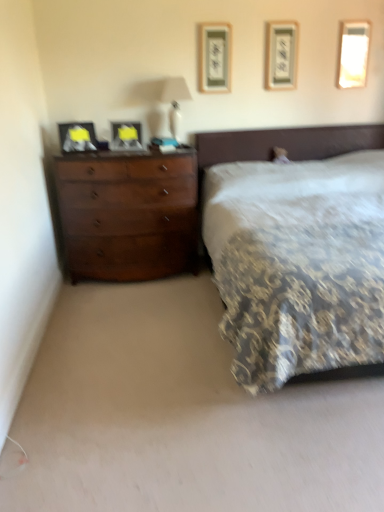
Identify the location of matte black picture frame at center, positioned as the fourth picture frame in right-to-left order. point(126,136).

Find the location of a particular element. Image resolution: width=384 pixels, height=512 pixels. matte wood picture frame at upper center, acting as the 3th picture frame starting from the right is located at coordinates (215, 57).

Describe the element at coordinates (281, 55) in the screenshot. I see `metallic silver picture frame at upper center, which is the fourth picture frame from left to right` at that location.

Where is `metallic silver picture frame at upper center, the 2th picture frame when ordered from right to left`? The height and width of the screenshot is (512, 384). metallic silver picture frame at upper center, the 2th picture frame when ordered from right to left is located at coordinates (281, 55).

Image resolution: width=384 pixels, height=512 pixels. Find the location of `patterned fabric bed at center`. patterned fabric bed at center is located at coordinates (280, 145).

The width and height of the screenshot is (384, 512). What do you see at coordinates (128, 215) in the screenshot?
I see `dark wood dresser at left` at bounding box center [128, 215].

Measure the distance between point (x=175, y=99) and camera.

11.29 feet.

Image resolution: width=384 pixels, height=512 pixels. Describe the element at coordinates (77, 137) in the screenshot. I see `matte black picture frame at left, placed as the 5th picture frame when sorted from right to left` at that location.

Image resolution: width=384 pixels, height=512 pixels. I want to click on matte black picture frame at center, positioned as the fourth picture frame in right-to-left order, so click(126, 136).

Is white glossy lampshade at upper center not within dark wood dresser at left?

Indeed, white glossy lampshade at upper center is completely outside dark wood dresser at left.

Is white glossy lampshade at upper center bigger than dark wood dresser at left?

Actually, white glossy lampshade at upper center might be smaller than dark wood dresser at left.

Can you tell me how much white glossy lampshade at upper center and dark wood dresser at left differ in facing direction?

white glossy lampshade at upper center and dark wood dresser at left are facing 4.61 degrees away from each other.

Is white glossy lampshade at upper center facing away from dark wood dresser at left?

No, white glossy lampshade at upper center is not facing away from dark wood dresser at left.

Considering the relative sizes of metallic silver picture frame at upper center, which is the fourth picture frame from left to right, and patterned fabric bed at center in the image provided, is metallic silver picture frame at upper center, which is the fourth picture frame from left to right, bigger than patterned fabric bed at center?

No, metallic silver picture frame at upper center, which is the fourth picture frame from left to right, is not bigger than patterned fabric bed at center.

From a real-world perspective, does metallic silver picture frame at upper center, the 2th picture frame when ordered from right to left, stand above patterned fabric bed at center?

Yes.

Is point (268, 23) positioned before point (356, 127)?

Yes, it is in front of point (356, 127).

What's the angular difference between metallic silver picture frame at upper center, the 2th picture frame when ordered from right to left, and patterned fabric bed at center's facing directions?

The facing directions of metallic silver picture frame at upper center, the 2th picture frame when ordered from right to left, and patterned fabric bed at center are 0.00918 degrees apart.

Does matte black picture frame at left, the 1th picture frame positioned from the left, contain matte wood picture frame at upper center, arranged as the third picture frame when viewed from the left?

No, matte wood picture frame at upper center, arranged as the third picture frame when viewed from the left, is not inside matte black picture frame at left, the 1th picture frame positioned from the left.

Between matte black picture frame at left, placed as the 5th picture frame when sorted from right to left, and matte wood picture frame at upper center, acting as the 3th picture frame starting from the right, which one has smaller width?

With smaller width is matte wood picture frame at upper center, acting as the 3th picture frame starting from the right.

Who is more distant, matte black picture frame at left, the 1th picture frame positioned from the left, or matte wood picture frame at upper center, arranged as the third picture frame when viewed from the left?

matte wood picture frame at upper center, arranged as the third picture frame when viewed from the left.

The image size is (384, 512). Find the location of `chest of drawers located on the left of white glossy picture frame at upper right, marked as the 1th picture frame in a right-to-left arrangement`. chest of drawers located on the left of white glossy picture frame at upper right, marked as the 1th picture frame in a right-to-left arrangement is located at coordinates (128, 215).

Is dark wood dresser at left oriented towards white glossy picture frame at upper right, marked as the 1th picture frame in a right-to-left arrangement?

No, dark wood dresser at left does not turn towards white glossy picture frame at upper right, marked as the 1th picture frame in a right-to-left arrangement.

Is dark wood dresser at left inside or outside of white glossy picture frame at upper right, which appears as the fifth picture frame when viewed from the left?

dark wood dresser at left cannot be found inside white glossy picture frame at upper right, which appears as the fifth picture frame when viewed from the left.

Between dark wood dresser at left and white glossy picture frame at upper right, which appears as the fifth picture frame when viewed from the left, which one appears on the left side from the viewer's perspective?

Positioned to the left is dark wood dresser at left.

In the scene shown: Considering the sizes of objects metallic silver picture frame at upper center, the 2th picture frame when ordered from right to left, and white glossy picture frame at upper right, marked as the 1th picture frame in a right-to-left arrangement, in the image provided, who is shorter, metallic silver picture frame at upper center, the 2th picture frame when ordered from right to left, or white glossy picture frame at upper right, marked as the 1th picture frame in a right-to-left arrangement,?

white glossy picture frame at upper right, marked as the 1th picture frame in a right-to-left arrangement.

Would you say metallic silver picture frame at upper center, the 2th picture frame when ordered from right to left, is to the left or to the right of white glossy picture frame at upper right, marked as the 1th picture frame in a right-to-left arrangement, in the picture?

Clearly, metallic silver picture frame at upper center, the 2th picture frame when ordered from right to left, is on the left of white glossy picture frame at upper right, marked as the 1th picture frame in a right-to-left arrangement, in the image.

Can you tell me how much metallic silver picture frame at upper center, which is the fourth picture frame from left to right, and white glossy picture frame at upper right, marked as the 1th picture frame in a right-to-left arrangement, differ in facing direction?

The angle between the facing direction of metallic silver picture frame at upper center, which is the fourth picture frame from left to right, and the facing direction of white glossy picture frame at upper right, marked as the 1th picture frame in a right-to-left arrangement, is 0.00842 degrees.

Does metallic silver picture frame at upper center, which is the fourth picture frame from left to right, have a greater width compared to white glossy picture frame at upper right, which appears as the fifth picture frame when viewed from the left?

Indeed, metallic silver picture frame at upper center, which is the fourth picture frame from left to right, has a greater width compared to white glossy picture frame at upper right, which appears as the fifth picture frame when viewed from the left.

Which object is thinner, matte black picture frame at center, positioned as the fourth picture frame in right-to-left order, or matte wood picture frame at upper center, acting as the 3th picture frame starting from the right?

matte wood picture frame at upper center, acting as the 3th picture frame starting from the right, is thinner.

Considering the positions of objects matte black picture frame at center, marked as the second picture frame in a left-to-right arrangement, and matte wood picture frame at upper center, arranged as the third picture frame when viewed from the left, in the image provided, who is more to the right, matte black picture frame at center, marked as the second picture frame in a left-to-right arrangement, or matte wood picture frame at upper center, arranged as the third picture frame when viewed from the left,?

From the viewer's perspective, matte wood picture frame at upper center, arranged as the third picture frame when viewed from the left, appears more on the right side.

Where is `the 1st picture frame in front of the matte wood picture frame at upper center, arranged as the third picture frame when viewed from the left, counting from the anchor's position`? The height and width of the screenshot is (512, 384). the 1st picture frame in front of the matte wood picture frame at upper center, arranged as the third picture frame when viewed from the left, counting from the anchor's position is located at coordinates tap(126, 136).

From a real-world perspective, which object stands above the other?

matte wood picture frame at upper center, arranged as the third picture frame when viewed from the left, is physically above.

Is white glossy picture frame at upper right, which appears as the fifth picture frame when viewed from the left, facing towards patterned fabric bed at center?

No, white glossy picture frame at upper right, which appears as the fifth picture frame when viewed from the left, is not aimed at patterned fabric bed at center.

From their relative heights in the image, would you say white glossy picture frame at upper right, which appears as the fifth picture frame when viewed from the left, is taller or shorter than patterned fabric bed at center?

Considering their sizes, white glossy picture frame at upper right, which appears as the fifth picture frame when viewed from the left, has less height than patterned fabric bed at center.

Considering the points (352, 39) and (199, 172), which point is in front, point (352, 39) or point (199, 172)?

Point (352, 39)

The height and width of the screenshot is (512, 384). Identify the location of picture frame on the right of patterned fabric bed at center. (353, 54).

You are a GUI agent. You are given a task and a screenshot of the screen. Output one action in this format:
    pyautogui.click(x=<x>, y=<y>)
    Task: Click on the chest of drawers below the white glossy lampshade at upper center (from the image's perspective)
    The width and height of the screenshot is (384, 512).
    Given the screenshot: What is the action you would take?
    coord(128,215)

I want to click on bed directly beneath the metallic silver picture frame at upper center, which is the fourth picture frame from left to right (from a real-world perspective), so click(x=280, y=145).

Based on their spatial positions, is patterned fabric bed at center or matte wood picture frame at upper center, arranged as the third picture frame when viewed from the left, closer to metallic silver picture frame at upper center, the 2th picture frame when ordered from right to left?

matte wood picture frame at upper center, arranged as the third picture frame when viewed from the left, is positioned closer to the anchor metallic silver picture frame at upper center, the 2th picture frame when ordered from right to left.

When comparing their distances from metallic silver picture frame at upper center, which is the fourth picture frame from left to right, does white glossy picture frame at upper right, marked as the 1th picture frame in a right-to-left arrangement, or matte black picture frame at left, placed as the 5th picture frame when sorted from right to left, seem closer?

white glossy picture frame at upper right, marked as the 1th picture frame in a right-to-left arrangement, lies closer to metallic silver picture frame at upper center, which is the fourth picture frame from left to right, than the other object.

Looking at the image, which one is located closer to white glossy lampshade at upper center, matte black picture frame at center, marked as the second picture frame in a left-to-right arrangement, or matte wood picture frame at upper center, arranged as the third picture frame when viewed from the left?

matte wood picture frame at upper center, arranged as the third picture frame when viewed from the left.

From the image, which object appears to be farther from matte black picture frame at left, the 1th picture frame positioned from the left, metallic silver picture frame at upper center, which is the fourth picture frame from left to right, or patterned fabric bed at center?

metallic silver picture frame at upper center, which is the fourth picture frame from left to right.

Based on their spatial positions, is dark wood dresser at left or matte wood picture frame at upper center, arranged as the third picture frame when viewed from the left, further from metallic silver picture frame at upper center, which is the fourth picture frame from left to right?

dark wood dresser at left lies further to metallic silver picture frame at upper center, which is the fourth picture frame from left to right, than the other object.

Considering their positions, is white glossy lampshade at upper center positioned closer to patterned fabric bed at center than matte black picture frame at center, marked as the second picture frame in a left-to-right arrangement?

white glossy lampshade at upper center.

Looking at the image, which one is located further to white glossy lampshade at upper center, matte wood picture frame at upper center, acting as the 3th picture frame starting from the right, or patterned fabric bed at center?

patterned fabric bed at center is positioned further to the anchor white glossy lampshade at upper center.

Which object lies further to the anchor point white glossy picture frame at upper right, which appears as the fifth picture frame when viewed from the left, metallic silver picture frame at upper center, the 2th picture frame when ordered from right to left, or matte wood picture frame at upper center, arranged as the third picture frame when viewed from the left?

matte wood picture frame at upper center, arranged as the third picture frame when viewed from the left, lies further to white glossy picture frame at upper right, which appears as the fifth picture frame when viewed from the left, than the other object.

Where is `chest of drawers between patterned fabric bed at center and white glossy picture frame at upper right, marked as the 1th picture frame in a right-to-left arrangement, in the front-back direction`? chest of drawers between patterned fabric bed at center and white glossy picture frame at upper right, marked as the 1th picture frame in a right-to-left arrangement, in the front-back direction is located at coordinates (128, 215).

Locate an element on the screen. Image resolution: width=384 pixels, height=512 pixels. bedside lamp situated between matte black picture frame at center, marked as the second picture frame in a left-to-right arrangement, and metallic silver picture frame at upper center, which is the fourth picture frame from left to right, from left to right is located at coordinates (174, 101).

The width and height of the screenshot is (384, 512). I want to click on chest of drawers between patterned fabric bed at center and metallic silver picture frame at upper center, the 2th picture frame when ordered from right to left, from front to back, so click(x=128, y=215).

Identify the location of bedside lamp between patterned fabric bed at center and matte wood picture frame at upper center, arranged as the third picture frame when viewed from the left, along the z-axis. (174, 101).